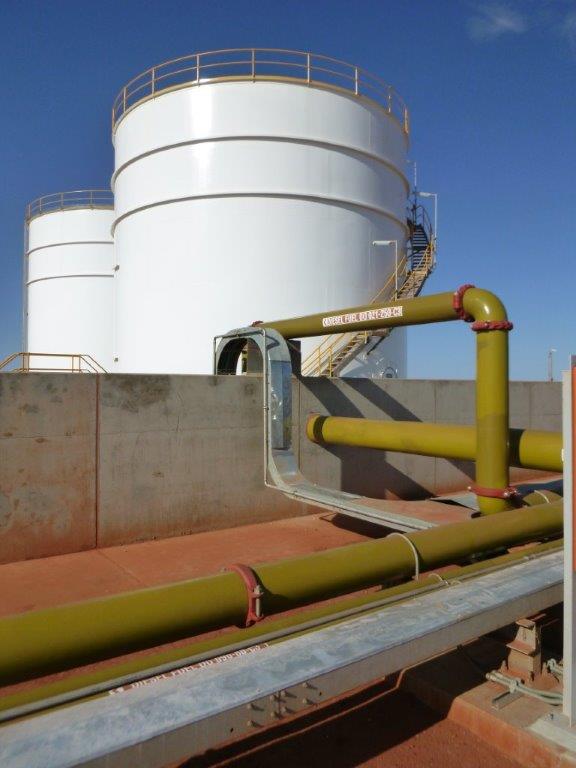
This screenshot has width=576, height=768. I want to click on cement wall on left side of image, so click(x=136, y=435).